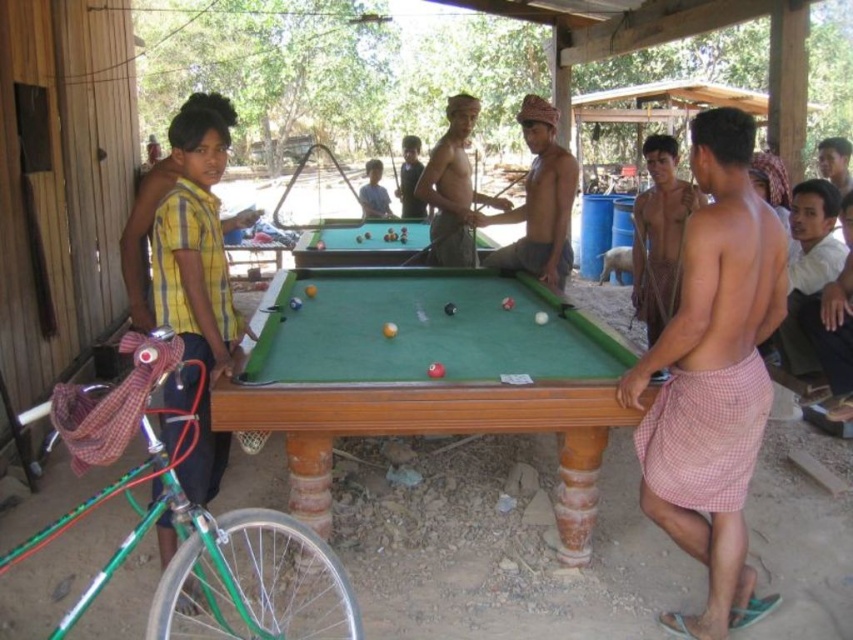
Does shiny brown skin at center have a lesser width compared to smooth skin boy at center?

Incorrect, shiny brown skin at center's width is not less than smooth skin boy at center's.

Based on the photo, can you confirm if shiny brown skin at center is taller than smooth skin boy at center?

Indeed, shiny brown skin at center has a greater height compared to smooth skin boy at center.

This screenshot has width=853, height=640. Identify the location of shiny brown skin at center. (453, 188).

Who is positioned more to the right, green metallic bicycle at lower left or yellow striped shirt at left?

From the viewer's perspective, green metallic bicycle at lower left appears more on the right side.

Identify the location of green metallic bicycle at lower left. (195, 529).

Is point (718, 484) farther from camera compared to point (819, 164)?

No, it is not.

Where is `pink checkered cloth at right`? pink checkered cloth at right is located at coordinates (712, 376).

Find the location of a particular element. Image resolution: width=853 pixels, height=640 pixels. pink checkered cloth at right is located at coordinates (712, 376).